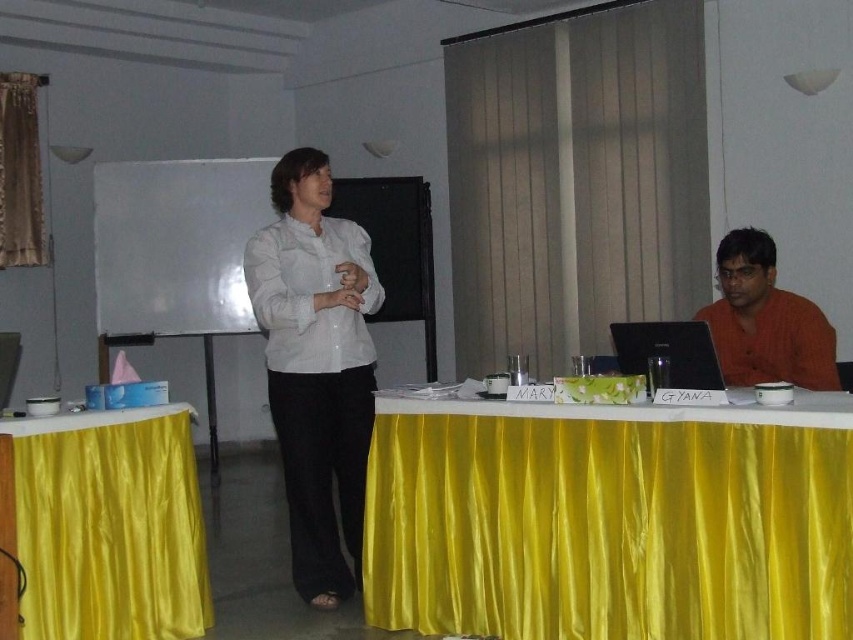
You are standing in the conference room and want to place a 10 feet long banner on the yellow satin table at lower left. Can the banner fit on the table?

The yellow satin table at lower left is 9.88 feet from camera, but the distance from the camera does not indicate the table length. The banner may not fit as the table length is unknown.

You are organizing a conference and need to place a large banner on the wall. The banner is as wide as the yellow satin table at lower left. Will it fit within the width of the gold satin curtain at upper left?

→ The yellow satin table at lower left might be wider than the gold satin curtain at upper left, so the banner may not fit within the width of the gold satin curtain at upper left.

Based on the photo, you are a guest speaker preparing to present. You notice the yellow satin table at lower left and the white glossy shirt at center. Which object is shorter in height?

The yellow satin table at lower left has a lesser height compared to the white glossy shirt at center, so the yellow satin table at lower left is shorter.